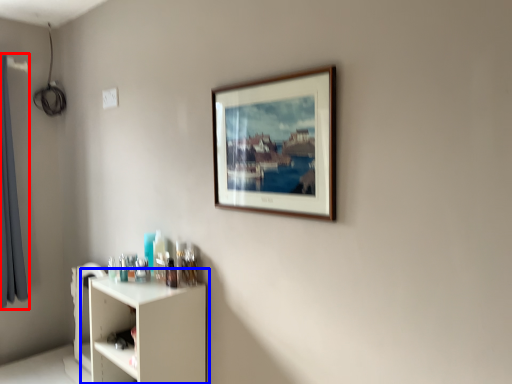
Question: Which point is further to the camera, curtain (highlighted by a red box) or shelf (highlighted by a blue box)?

Choices:
 (A) curtain
 (B) shelf

Answer: (A)